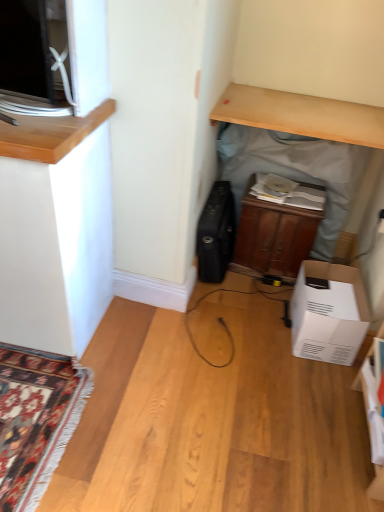
Find the location of a particular element. free space in front of wooden cabinet at center is located at coordinates (258, 301).